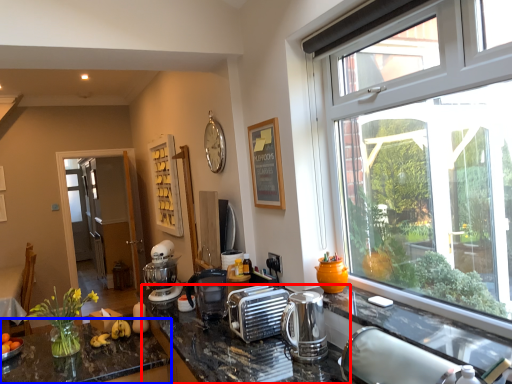
Question: Which of the following is the farthest to the observer, counter top (highlighted by a red box) or countertop (highlighted by a blue box)?

Choices:
 (A) counter top
 (B) countertop

Answer: (B)